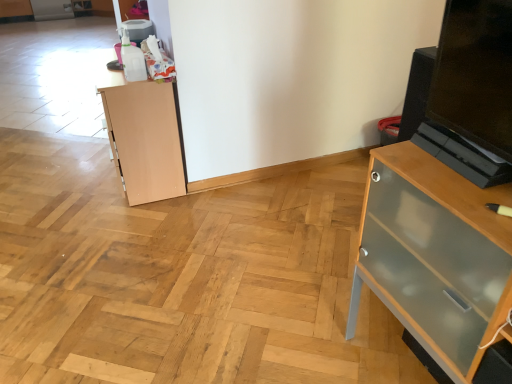
The width and height of the screenshot is (512, 384). Describe the element at coordinates (144, 137) in the screenshot. I see `light brown wood cupboard at left` at that location.

Measure the distance between point (125, 161) and camera.

The distance of point (125, 161) from camera is 2.24 meters.

Where is `light brown wood cupboard at left`? light brown wood cupboard at left is located at coordinates (144, 137).

Measure the distance between light brown wood cupboard at left and camera.

light brown wood cupboard at left and camera are 2.03 meters apart from each other.

In order to click on clear glass cabinet at right in this screenshot , I will do `click(435, 255)`.

The image size is (512, 384). Describe the element at coordinates (435, 255) in the screenshot. I see `clear glass cabinet at right` at that location.

Find the location of `light brown wood cupboard at left`. light brown wood cupboard at left is located at coordinates (144, 137).

Which object is positioned more to the right, light brown wood cupboard at left or clear glass cabinet at right?

clear glass cabinet at right.

Considering the positions of objects light brown wood cupboard at left and clear glass cabinet at right in the image provided, who is in front, light brown wood cupboard at left or clear glass cabinet at right?

clear glass cabinet at right is in front.

Considering the positions of points (165, 117) and (494, 298), is point (165, 117) farther from camera compared to point (494, 298)?

Yes, it is behind point (494, 298).

From the image's perspective, is light brown wood cupboard at left on top of clear glass cabinet at right?

Yes.

From a real-world perspective, does light brown wood cupboard at left stand above clear glass cabinet at right?

Incorrect, from a real-world perspective, light brown wood cupboard at left is lower than clear glass cabinet at right.

Between light brown wood cupboard at left and clear glass cabinet at right, which one has larger width?

clear glass cabinet at right.

Can you confirm if light brown wood cupboard at left is taller than clear glass cabinet at right?

No, light brown wood cupboard at left is not taller than clear glass cabinet at right.

Does light brown wood cupboard at left have a larger size compared to clear glass cabinet at right?

Incorrect, light brown wood cupboard at left is not larger than clear glass cabinet at right.

Is light brown wood cupboard at left completely or partially outside of clear glass cabinet at right?

That's correct, light brown wood cupboard at left is outside of clear glass cabinet at right.

Is there a large distance between light brown wood cupboard at left and clear glass cabinet at right?

Absolutely, light brown wood cupboard at left is distant from clear glass cabinet at right.

Is light brown wood cupboard at left facing away from clear glass cabinet at right?

No, clear glass cabinet at right is not at the back of light brown wood cupboard at left.

Can you tell me how much light brown wood cupboard at left and clear glass cabinet at right differ in facing direction?

light brown wood cupboard at left and clear glass cabinet at right are facing 0.506 degrees away from each other.

I want to click on chest of drawers on the right of light brown wood cupboard at left, so (435, 255).

Would you say clear glass cabinet at right is to the left or to the right of light brown wood cupboard at left in the picture?

clear glass cabinet at right is positioned on light brown wood cupboard at left's right side.

Which is behind, clear glass cabinet at right or light brown wood cupboard at left?

light brown wood cupboard at left is more distant.

Is point (371, 198) closer to viewer compared to point (142, 140)?

Yes, point (371, 198) is closer to viewer.

From the image's perspective, which one is positioned higher, clear glass cabinet at right or light brown wood cupboard at left?

light brown wood cupboard at left appears higher in the image.

Based on the photo, from a real-world perspective, is clear glass cabinet at right positioned above or below light brown wood cupboard at left?

In terms of real-world spatial position, clear glass cabinet at right is above light brown wood cupboard at left.

Can you confirm if clear glass cabinet at right is thinner than light brown wood cupboard at left?

No.

Based on the photo, considering the sizes of objects clear glass cabinet at right and light brown wood cupboard at left in the image provided, who is shorter, clear glass cabinet at right or light brown wood cupboard at left?

light brown wood cupboard at left.

Which of these two, clear glass cabinet at right or light brown wood cupboard at left, is bigger?

Bigger between the two is clear glass cabinet at right.

Could light brown wood cupboard at left be considered to be inside clear glass cabinet at right?

No.

Are clear glass cabinet at right and light brown wood cupboard at left beside each other?

They are not placed beside each other.

Could you tell me if clear glass cabinet at right is facing light brown wood cupboard at left?

No, clear glass cabinet at right is not turned towards light brown wood cupboard at left.

Can you tell me how much clear glass cabinet at right and light brown wood cupboard at left differ in facing direction?

The angular difference between clear glass cabinet at right and light brown wood cupboard at left is 0.506 degrees.

You are a GUI agent. You are given a task and a screenshot of the screen. Output one action in this format:
    pyautogui.click(x=<x>, y=<y>)
    Task: Click on the chest of drawers above the light brown wood cupboard at left (from a real-world perspective)
    The image size is (512, 384).
    Given the screenshot: What is the action you would take?
    pyautogui.click(x=435, y=255)

Find the location of a particular element. the chest of drawers located above the light brown wood cupboard at left (from a real-world perspective) is located at coordinates (435, 255).

The width and height of the screenshot is (512, 384). I want to click on chest of drawers on the right of light brown wood cupboard at left, so click(x=435, y=255).